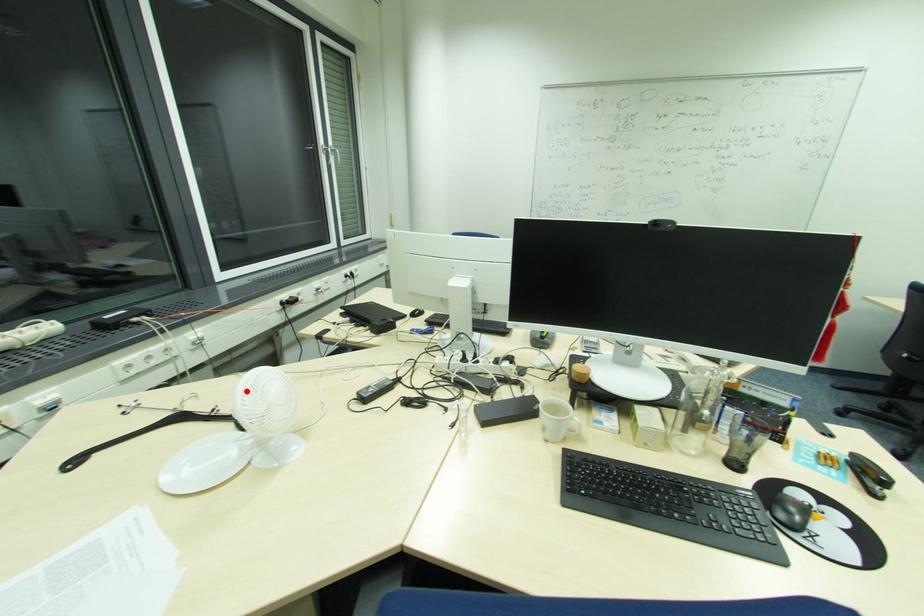
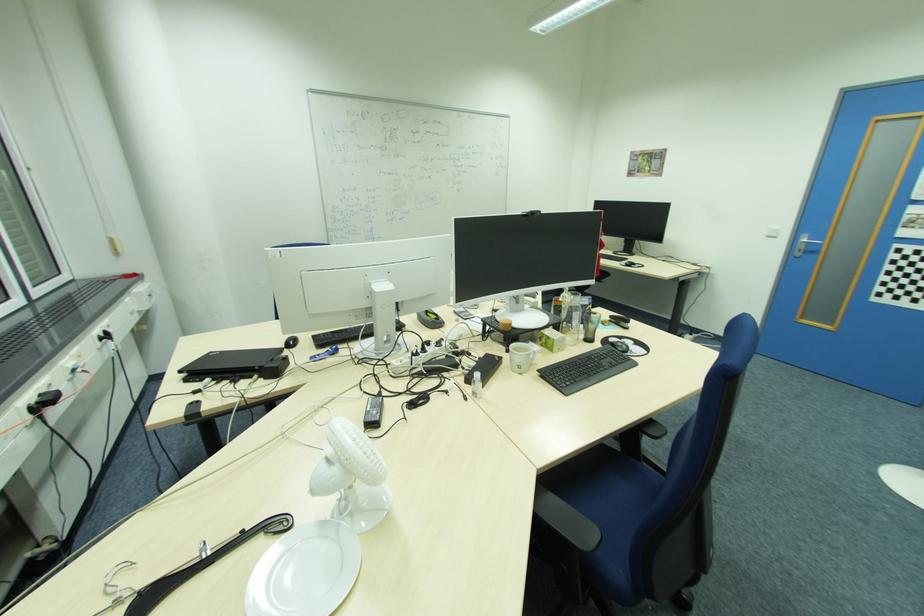
Find the pixel in the second image that matches the highlighted location in the first image.

(360, 444)